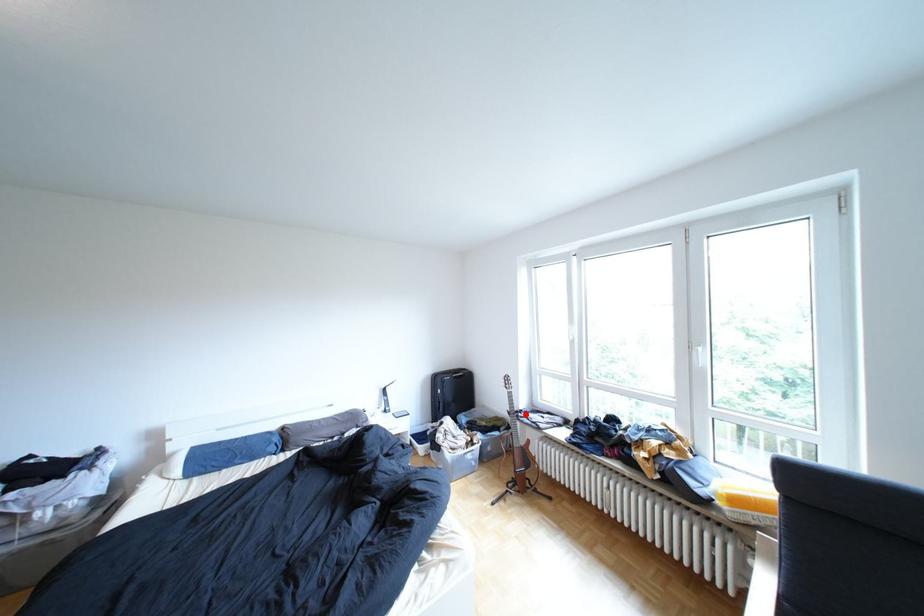
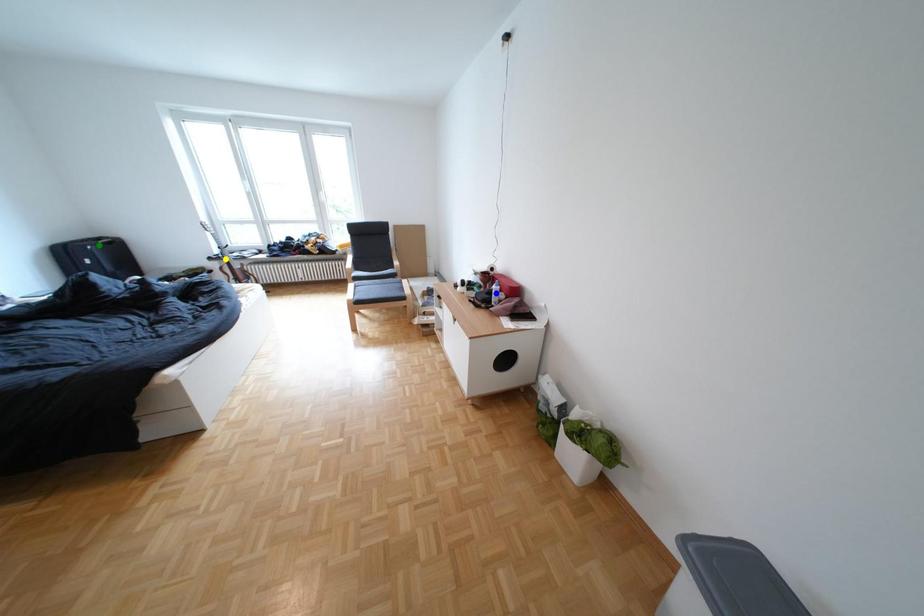
Question: I am providing you with two images of the same scene from different viewpoints. A red point is marked on the first image. You are given multiple points on the second image. Which spot in image 2 lines up with the point in image 1?

Choices:
 (A) yellow point
 (B) blue point
 (C) green point

Answer: (A)